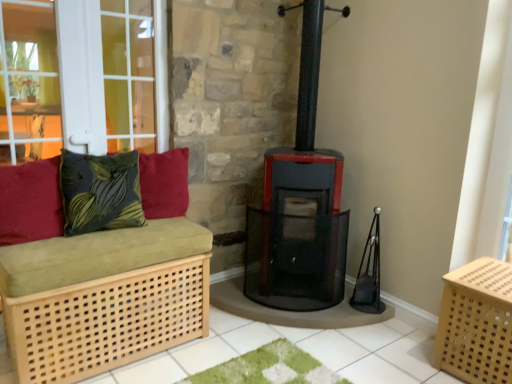
Locate an element on the screen. free space above light wood/light brown bench at left (from a real-world perspective) is located at coordinates (100, 233).